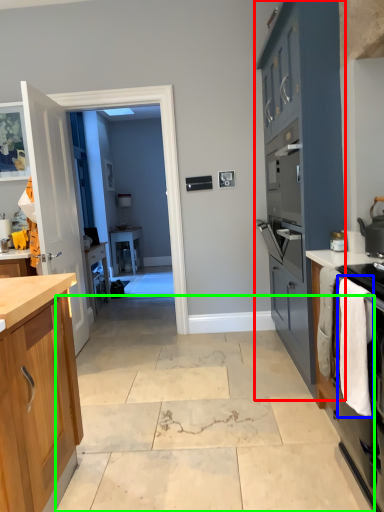
Question: Which is farther away from cabinetry (highlighted by a red box)? laundry (highlighted by a blue box) or concrete (highlighted by a green box)?

Choices:
 (A) laundry
 (B) concrete

Answer: (B)